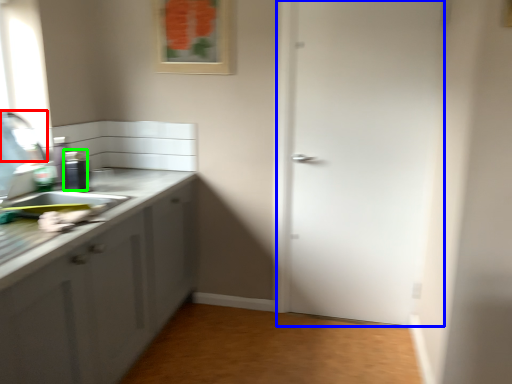
Question: Which object is positioned closest to faucet (highlighted by a red box)? Select from door (highlighted by a blue box) and appliance (highlighted by a green box).

Choices:
 (A) door
 (B) appliance

Answer: (B)